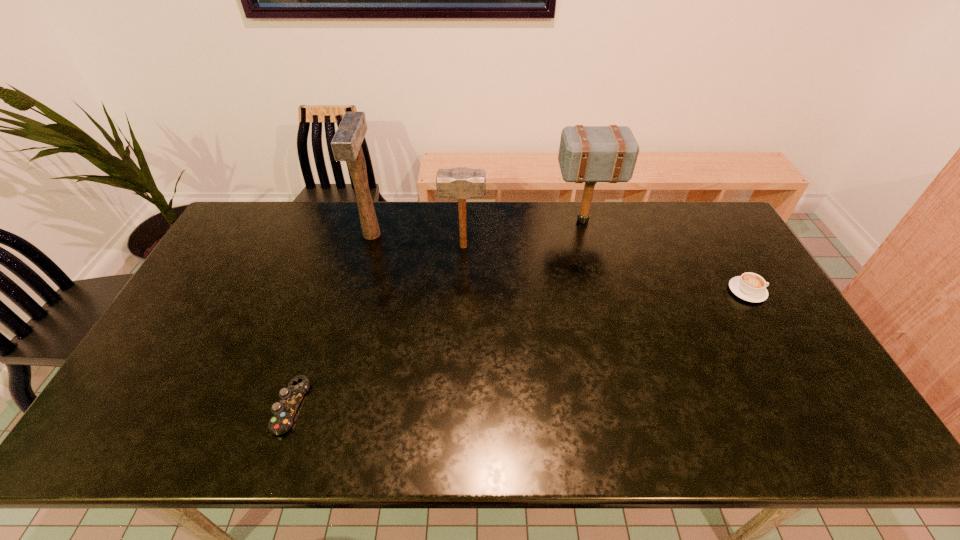
Identify the location of free spot located on the front of the second object from left to right. The height and width of the screenshot is (540, 960). (359, 281).

Locate an element on the screen. This screenshot has width=960, height=540. free space located on the striking surface of the fourth shortest object is located at coordinates (446, 220).

I want to click on vacant space positioned 0.290m on the striking surface of the fourth shortest object, so click(x=472, y=220).

Image resolution: width=960 pixels, height=540 pixels. Identify the location of free spot located on the striking surface of the fourth shortest object. (508, 220).

Identify the location of vacant position located 0.080m on the striking face of the second mallet from right to left. (509, 247).

Locate an element on the screen. free region located on the left of the shortest object is located at coordinates (140, 406).

The height and width of the screenshot is (540, 960). I want to click on object that is positioned at the near edge, so click(x=284, y=410).

Image resolution: width=960 pixels, height=540 pixels. I want to click on object located in the right edge section of the desktop, so click(x=751, y=287).

Image resolution: width=960 pixels, height=540 pixels. In the image, there is a desktop. Identify the location of blank space at the far edge. pyautogui.click(x=543, y=200).

Locate an element on the screen. This screenshot has width=960, height=540. blank space at the near edge of the desktop is located at coordinates (586, 431).